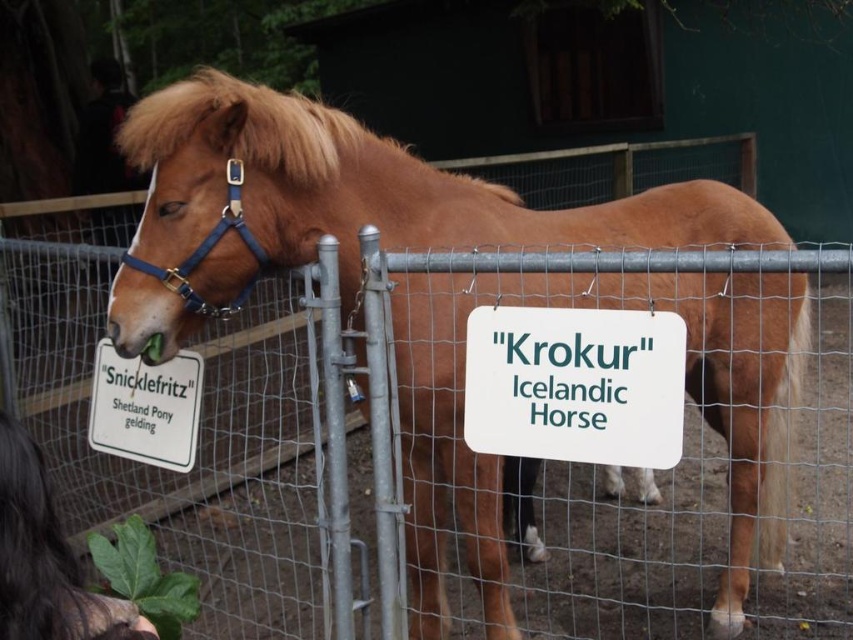
Is brown glossy icelandic horse at center smaller than white plastic sign at left?

Incorrect, brown glossy icelandic horse at center is not smaller in size than white plastic sign at left.

Does point (270, 154) come in front of point (148, 424)?

Yes, point (270, 154) is closer to viewer.

Between point (180, 173) and point (102, 397), which one is positioned behind?

Positioned behind is point (102, 397).

At what (x,y) coordinates should I click in order to perform the action: click on brown glossy icelandic horse at center. Please return your answer as a coordinate pair (x, y). This screenshot has height=640, width=853. Looking at the image, I should click on (343, 205).

Can you confirm if white plastic sign at center is thinner than white plastic sign at left?

Incorrect, white plastic sign at center's width is not less than white plastic sign at left's.

Can you confirm if white plastic sign at center is positioned to the right of white plastic sign at left?

Indeed, white plastic sign at center is positioned on the right side of white plastic sign at left.

Who is more distant from viewer, [607,422] or [190,352]?

Point [190,352]

Identify the location of white plastic sign at center. (575, 385).

How distant is brown glossy icelandic horse at center from white plastic sign at center?

brown glossy icelandic horse at center and white plastic sign at center are 17.48 inches apart from each other.

Is brown glossy icelandic horse at center closer to the viewer compared to white plastic sign at center?

No.

You are a GUI agent. You are given a task and a screenshot of the screen. Output one action in this format:
    pyautogui.click(x=<x>, y=<y>)
    Task: Click on the brown glossy icelandic horse at center
    This screenshot has height=640, width=853.
    Given the screenshot: What is the action you would take?
    pos(343,205)

Where is `brown glossy icelandic horse at center`? The image size is (853, 640). brown glossy icelandic horse at center is located at coordinates (343, 205).